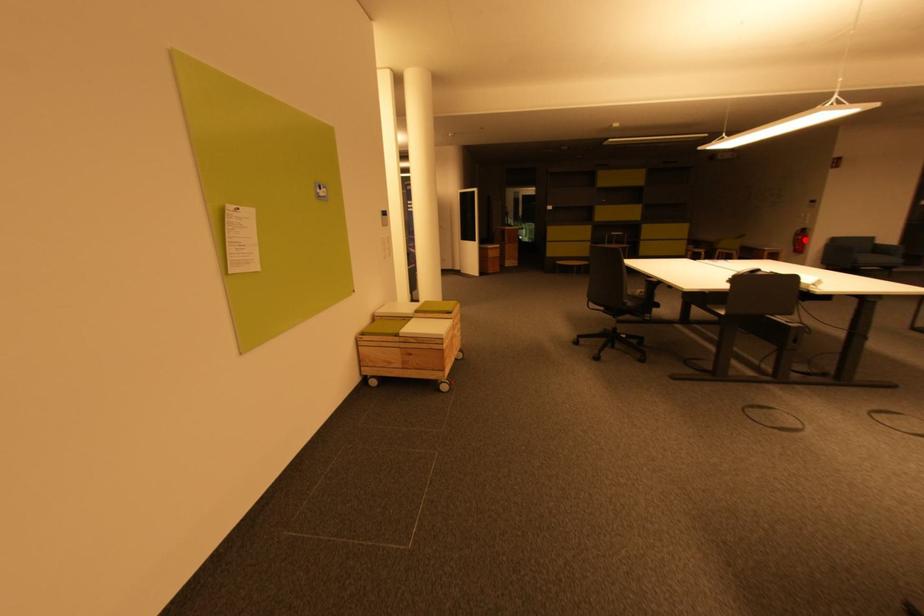
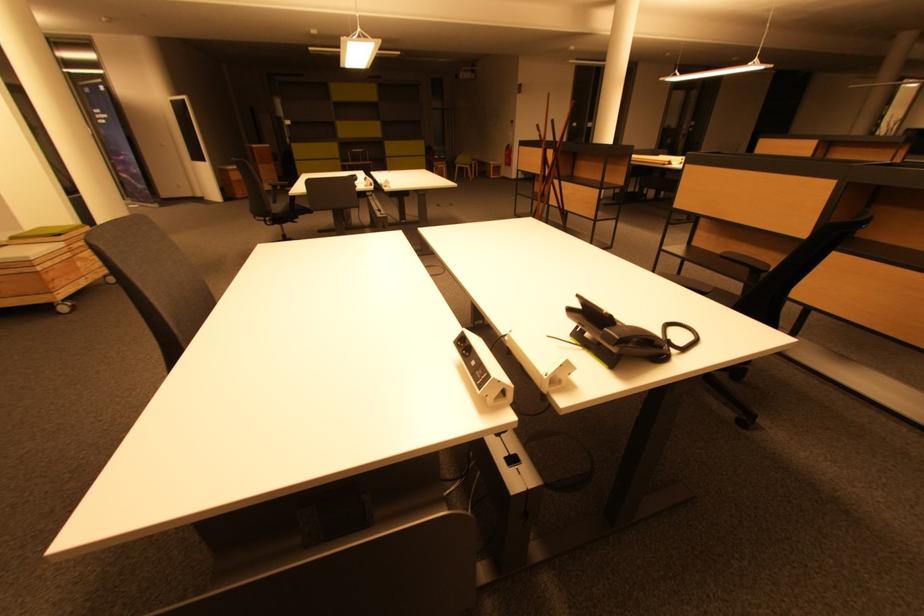
Question: I am providing you with two images of the same scene from different viewpoints. Given a red point in image1, look at the same physical point in image2. Is it:

Choices:
 (A) Closer to the viewpoint
 (B) Farther from the viewpoint

Answer: (A)